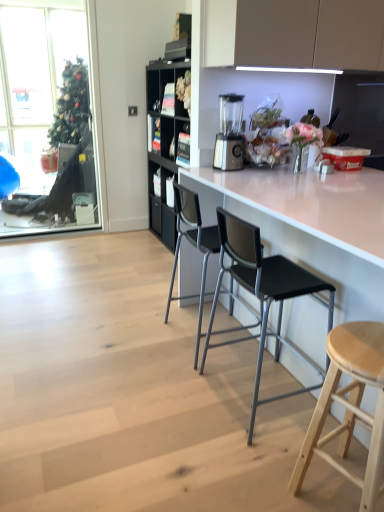
Question: Choose the correct answer: Is light wood stool at lower right inside satin silver blender at center or outside it?

Choices:
 (A) inside
 (B) outside

Answer: (B)

Question: From the image's perspective, is light wood stool at lower right above or below satin silver blender at center?

Choices:
 (A) above
 (B) below

Answer: (B)

Question: Estimate the real-world distances between objects in this image. Which object is farther from the black plastic chair at center, the second chair from the back?

Choices:
 (A) clear glass window at upper left
 (B) white glossy counter at center
 (C) black plastic chair at center, which is the 2th chair from front to back
 (D) light wood stool at lower right
 (E) satin silver blender at center

Answer: (A)

Question: Considering the real-world distances, which object is closest to the white glossy counter at center?

Choices:
 (A) black plastic chair at center, the 1th chair in the back-to-front sequence
 (B) black plastic chair at center, acting as the 1th chair starting from the front
 (C) satin silver blender at center
 (D) light wood stool at lower right
 (E) clear glass window at upper left

Answer: (B)